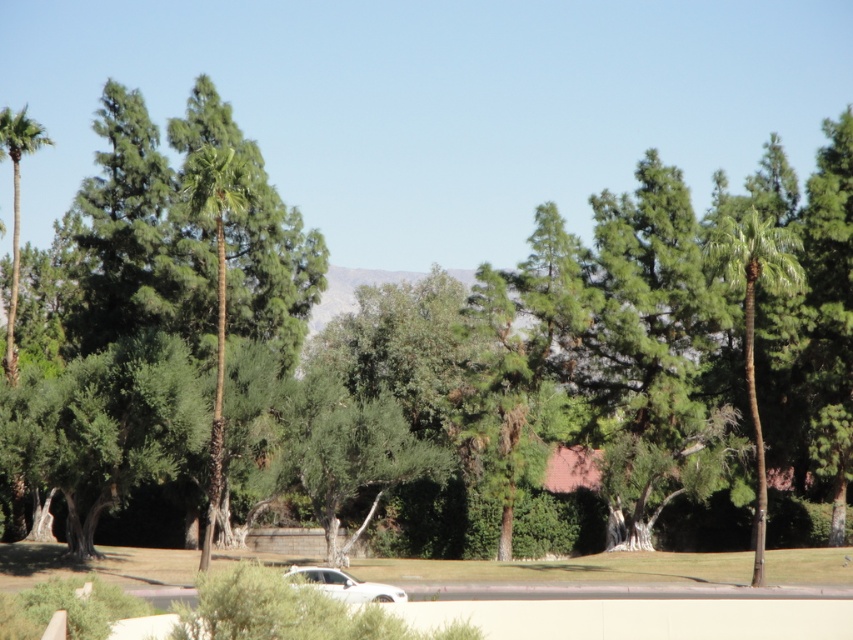
Question: Which point appears farthest from the camera in this image?

Choices:
 (A) (753, 424)
 (B) (13, 125)
 (C) (405, 596)
 (D) (194, 172)

Answer: (B)

Question: Which of the following is the closest to the observer?

Choices:
 (A) (790, 256)
 (B) (192, 152)
 (C) (16, 182)

Answer: (A)

Question: Can you confirm if green leafy palm tree at center is positioned below green leafy palm tree at left?

Choices:
 (A) no
 (B) yes

Answer: (B)

Question: Estimate the real-world distances between objects in this image. Which object is closer to the green leafy palm tree at left?

Choices:
 (A) white matte car at lower center
 (B) green leafy palm tree at center

Answer: (B)

Question: Does green leafy palm tree at center appear over white matte car at lower center?

Choices:
 (A) yes
 (B) no

Answer: (A)

Question: Can you confirm if green leafy palm tree at left is positioned above white matte car at lower center?

Choices:
 (A) no
 (B) yes

Answer: (B)